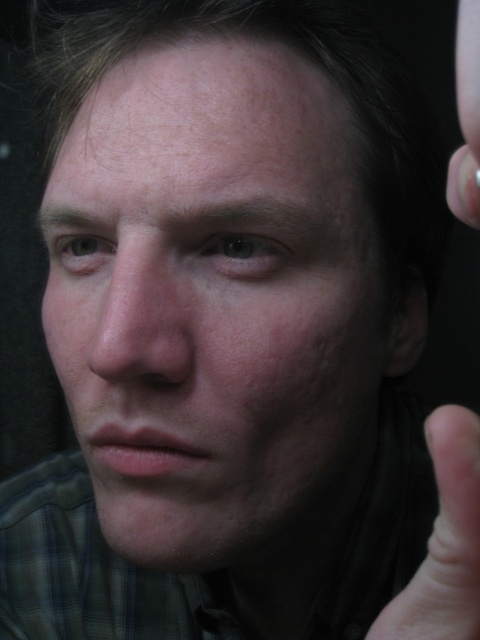
Does smooth skin face at center have a smaller size compared to smooth skin thumb at lower right?

Incorrect, smooth skin face at center is not smaller in size than smooth skin thumb at lower right.

Who is higher up, smooth skin face at center or smooth skin thumb at lower right?

smooth skin face at center is above.

The width and height of the screenshot is (480, 640). I want to click on smooth skin face at center, so tap(216, 305).

You are a GUI agent. You are given a task and a screenshot of the screen. Output one action in this format:
    pyautogui.click(x=<x>, y=<y>)
    Task: Click on the smooth skin face at center
    The height and width of the screenshot is (640, 480).
    Given the screenshot: What is the action you would take?
    pyautogui.click(x=216, y=305)